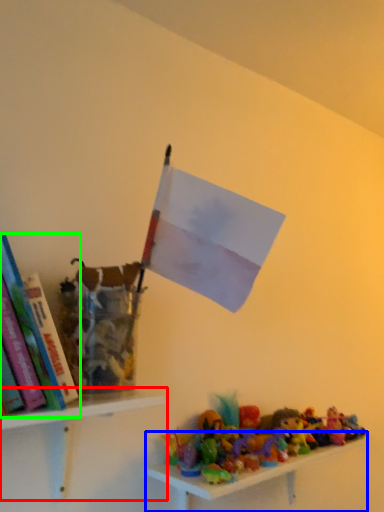
Question: Which object is the closest to the shelf (highlighted by a red box)? Choose among these: shelf (highlighted by a blue box) or book (highlighted by a green box).

Choices:
 (A) shelf
 (B) book

Answer: (B)